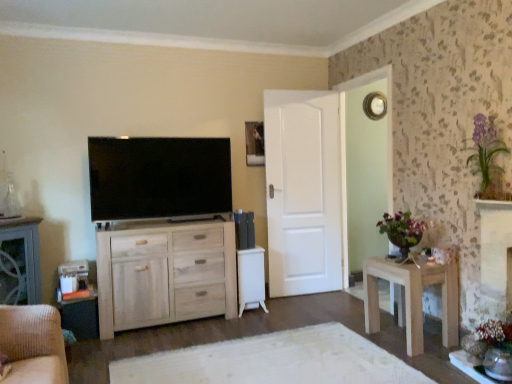
Question: Is purple glass vase at upper right wider or thinner than light wood table at right?

Choices:
 (A) thin
 (B) wide

Answer: (A)

Question: Is purple glass vase at upper right inside the boundaries of light wood table at right, or outside?

Choices:
 (A) inside
 (B) outside

Answer: (B)

Question: Estimate the real-world distances between objects in this image. Which object is closer to the light wood table at right?

Choices:
 (A) flat screen tv at upper left
 (B) natural wood cabinet at center
 (C) white matte door at center
 (D) matte black picture frame at upper center
 (E) purple glass vase at upper right

Answer: (E)

Question: Estimate the real-world distances between objects in this image. Which object is closer to the matte white glass door at upper right?

Choices:
 (A) matte gray cabinet at left
 (B) flat screen tv at upper left
 (C) natural wood cabinet at center
 (D) matte black picture frame at upper center
 (E) white matte door at center

Answer: (E)